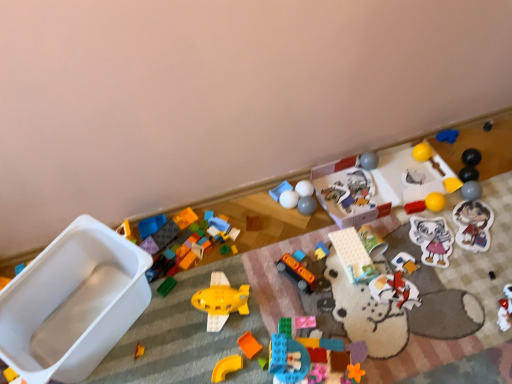
Locate an element on the screen. unoccupied region to the right of matte gray ball at center, which appears as the 14th toy when viewed from the left is located at coordinates (345, 202).